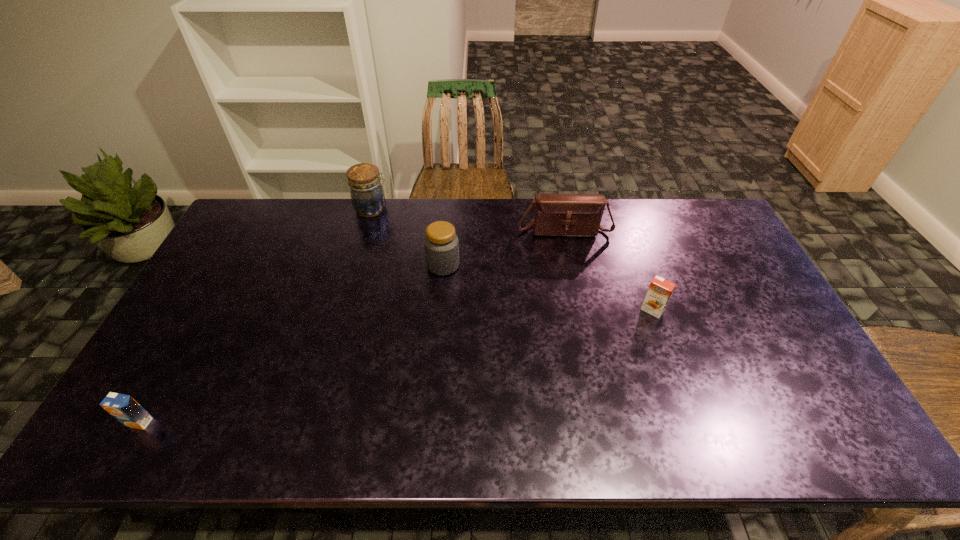
The width and height of the screenshot is (960, 540). Find the location of `free point between the second farthest object and the left orange_juice`. free point between the second farthest object and the left orange_juice is located at coordinates (351, 326).

Find the location of a particular element. This screenshot has width=960, height=540. free space between the farther orange_juice and the shoulder bag is located at coordinates (608, 269).

Where is `free point between the farthest object and the farther orange_juice`? free point between the farthest object and the farther orange_juice is located at coordinates (513, 259).

Find the location of a particular element. Image resolution: width=960 pixels, height=540 pixels. free space that is in between the shoulder bag and the third nearest object is located at coordinates (504, 247).

You are a GUI agent. You are given a task and a screenshot of the screen. Output one action in this format:
    pyautogui.click(x=<x>, y=<y>)
    Task: Click on the object identified as the fourth closest to the rightmost object
    This screenshot has height=540, width=960.
    Given the screenshot: What is the action you would take?
    pyautogui.click(x=124, y=408)

Identify the location of the fourth closest object to the third nearest object. Image resolution: width=960 pixels, height=540 pixels. (124, 408).

Where is `free space that satisfies the following two spatial constraints: 1. on the front flap of the fourth object from left to right; 2. on the surface of the nearer jar near the warning symbol`? This screenshot has height=540, width=960. free space that satisfies the following two spatial constraints: 1. on the front flap of the fourth object from left to right; 2. on the surface of the nearer jar near the warning symbol is located at coordinates (571, 265).

Find the location of a particular element. The height and width of the screenshot is (540, 960). blank space that satisfies the following two spatial constraints: 1. on the surface of the right orange_juice near the warning symbol; 2. on the left side of the right jar is located at coordinates (440, 310).

Find the location of a particular element. Image resolution: width=960 pixels, height=540 pixels. free spot that satisfies the following two spatial constraints: 1. on the front flap of the fourth object from left to right; 2. on the surface of the right jar near the warning symbol is located at coordinates (571, 265).